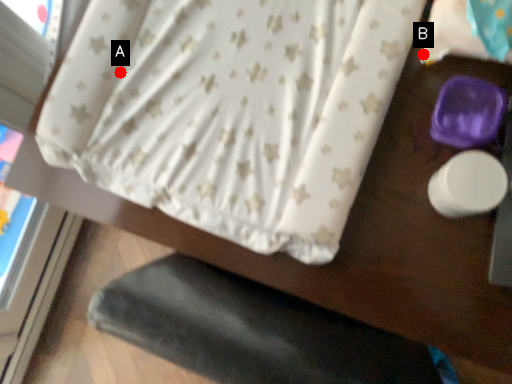
Question: Two points are circled on the image, labeled by A and B beside each circle. Which point is farther from the camera taking this photo?

Choices:
 (A) A is further
 (B) B is further

Answer: (A)